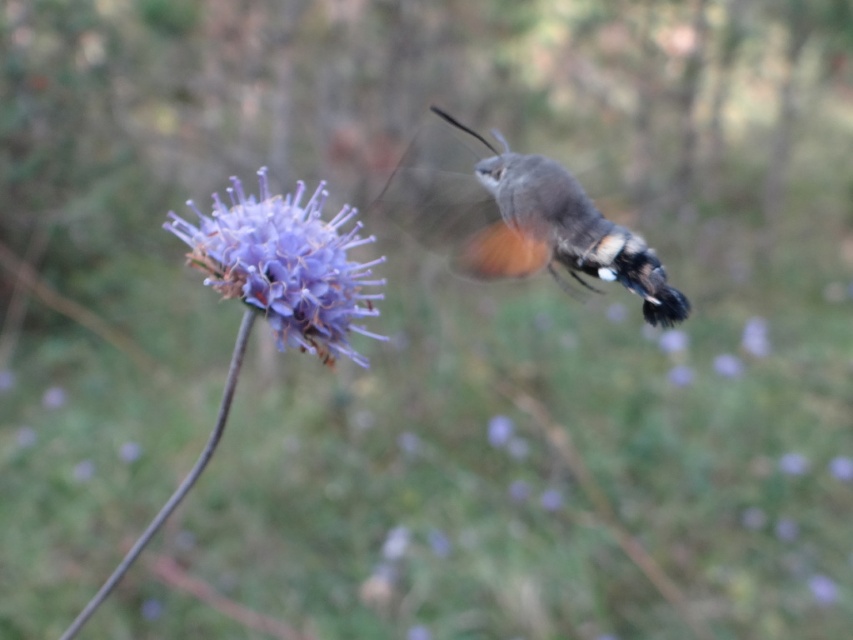
Question: Can you confirm if gray matte moth at upper right is thinner than purple fluffy flower at center?

Choices:
 (A) no
 (B) yes

Answer: (A)

Question: Among these objects, which one is farthest from the camera?

Choices:
 (A) purple fluffy flower at center
 (B) gray matte moth at upper right

Answer: (B)

Question: Which point appears closest to the camera in this image?

Choices:
 (A) (456, 156)
 (B) (251, 260)

Answer: (B)

Question: Is gray matte moth at upper right positioned behind purple fluffy flower at center?

Choices:
 (A) yes
 (B) no

Answer: (A)

Question: Does gray matte moth at upper right have a lesser width compared to purple fluffy flower at center?

Choices:
 (A) no
 (B) yes

Answer: (A)